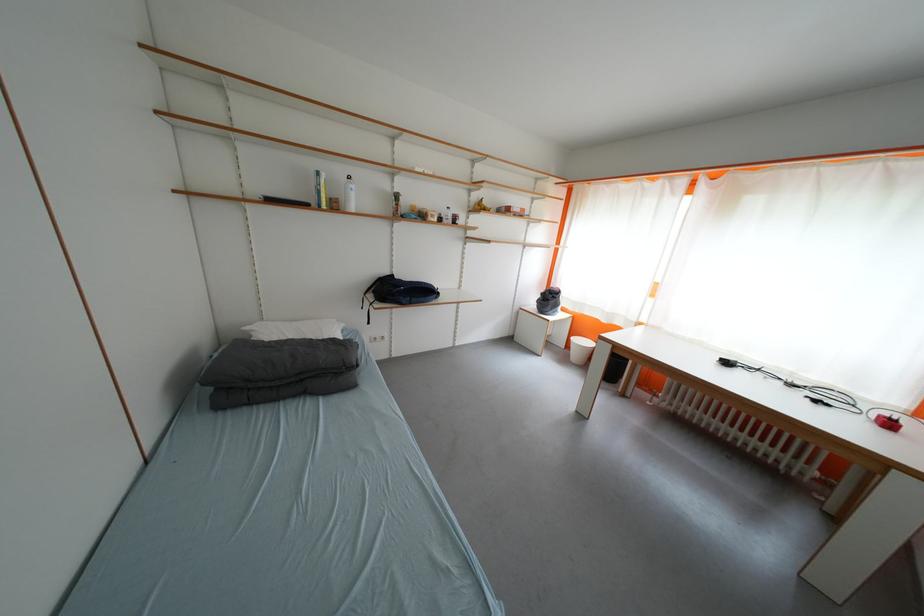
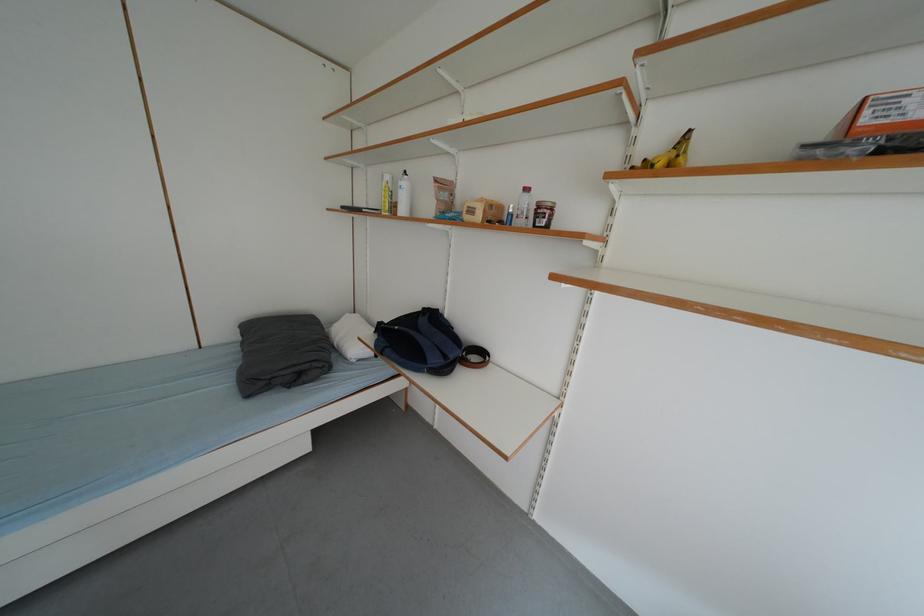
In the second image, find the point that corresponds to [422,302] in the first image.

(396, 354)